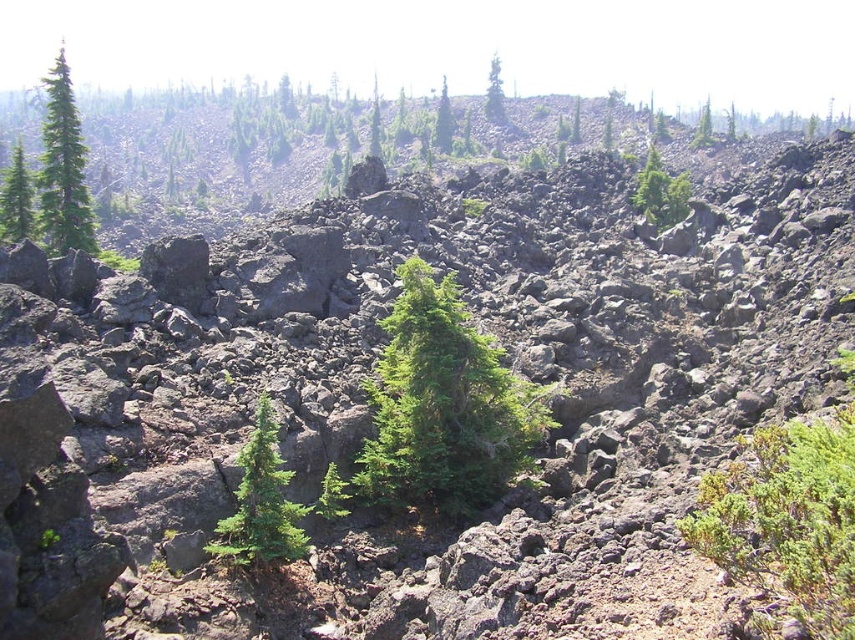
Is green matte tree at left to the right of green matte tree at upper center from the viewer's perspective?

Incorrect, green matte tree at left is not on the right side of green matte tree at upper center.

Which of these two, green matte tree at left or green matte tree at upper center, stands taller?

With more height is green matte tree at upper center.

The image size is (855, 640). In order to click on green matte tree at left in this screenshot , I will do `click(16, 198)`.

Which of these two, green textured tree at center or green matte tree at left, stands taller?

green matte tree at left is taller.

Who is more distant from viewer, (432, 352) or (12, 216)?

The point (12, 216) is behind.

The height and width of the screenshot is (640, 855). Find the location of `green textured tree at center`. green textured tree at center is located at coordinates (443, 406).

Does green shrub at lower right have a smaller size compared to green matte tree at upper center?

Correct, green shrub at lower right occupies less space than green matte tree at upper center.

Is green shrub at lower right thinner than green matte tree at upper center?

Correct, green shrub at lower right's width is less than green matte tree at upper center's.

Locate an element on the screen. The height and width of the screenshot is (640, 855). green shrub at lower right is located at coordinates (787, 518).

At what (x,y) coordinates should I click in order to perform the action: click on green shrub at lower right. Please return your answer as a coordinate pair (x, y). The width and height of the screenshot is (855, 640). Looking at the image, I should click on (787, 518).